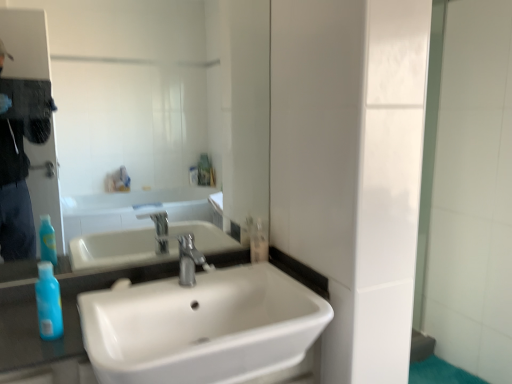
Identify the location of matte glass mirror at upper center. (162, 94).

The height and width of the screenshot is (384, 512). Describe the element at coordinates (258, 243) in the screenshot. I see `clear plastic bottle at center, positioned as the second mouthwash in front-to-back order` at that location.

What do you see at coordinates (204, 328) in the screenshot?
I see `white glossy sink at center` at bounding box center [204, 328].

Describe the element at coordinates (189, 260) in the screenshot. I see `silver metallic faucet at center` at that location.

In order to click on blue translucent bottle at lower left, the 2th mouthwash positioned from the right in this screenshot , I will do `click(48, 303)`.

Identify the location of mouthwash that appears below the clear plastic bottle at center, acting as the second mouthwash starting from the left (from the image's perspective). (48, 303).

Is clear plastic bottle at center, which is the 1th mouthwash from back to front, located outside blue translucent bottle at lower left, the 1th mouthwash when ordered from left to right?

Yes, clear plastic bottle at center, which is the 1th mouthwash from back to front, is not within blue translucent bottle at lower left, the 1th mouthwash when ordered from left to right.

Between clear plastic bottle at center, acting as the second mouthwash starting from the left, and blue translucent bottle at lower left, the 2th mouthwash positioned from the right, which one is positioned behind?

clear plastic bottle at center, acting as the second mouthwash starting from the left, is further from the camera.

From a real-world perspective, between clear plastic bottle at center, acting as the second mouthwash starting from the left, and blue translucent bottle at lower left, the 2th mouthwash positioned from the right, who is vertically lower?

blue translucent bottle at lower left, the 2th mouthwash positioned from the right, is physically lower.

From the image's perspective, is silver metallic faucet at center located above blue translucent bottle at lower left, the 2th mouthwash from the back?

Indeed, from the image's perspective, silver metallic faucet at center is shown above blue translucent bottle at lower left, the 2th mouthwash from the back.

Between silver metallic faucet at center and blue translucent bottle at lower left, the 2th mouthwash positioned from the right, which one appears on the right side from the viewer's perspective?

silver metallic faucet at center is more to the right.

Which of these two, silver metallic faucet at center or blue translucent bottle at lower left, the 2th mouthwash positioned from the right, is thinner?

Thinner between the two is blue translucent bottle at lower left, the 2th mouthwash positioned from the right.

From a real-world perspective, is silver metallic faucet at center located beneath blue translucent bottle at lower left, the 2th mouthwash positioned from the right?

No, from a real-world perspective, silver metallic faucet at center is not beneath blue translucent bottle at lower left, the 2th mouthwash positioned from the right.

Is blue translucent bottle at lower left, the 1th mouthwash when ordered from left to right, wider than clear plastic bottle at center, which is the 1th mouthwash from back to front?

Incorrect, the width of blue translucent bottle at lower left, the 1th mouthwash when ordered from left to right, does not surpass that of clear plastic bottle at center, which is the 1th mouthwash from back to front.

Do you think blue translucent bottle at lower left, the 1th mouthwash when ordered from left to right, is within clear plastic bottle at center, which is the 1th mouthwash from back to front, or outside of it?

blue translucent bottle at lower left, the 1th mouthwash when ordered from left to right, cannot be found inside clear plastic bottle at center, which is the 1th mouthwash from back to front.

Identify the location of mouthwash on the right of blue translucent bottle at lower left, the 2th mouthwash from the back. The width and height of the screenshot is (512, 384). pyautogui.click(x=258, y=243).

Which object is positioned more to the right, blue translucent bottle at lower left, the 1th mouthwash when ordered from left to right, or clear plastic bottle at center, placed as the first mouthwash when sorted from right to left?

clear plastic bottle at center, placed as the first mouthwash when sorted from right to left.

Is clear plastic bottle at center, placed as the first mouthwash when sorted from right to left, surrounded by silver metallic faucet at center?

No, clear plastic bottle at center, placed as the first mouthwash when sorted from right to left, is not surrounded by silver metallic faucet at center.

From a real-world perspective, between silver metallic faucet at center and clear plastic bottle at center, placed as the first mouthwash when sorted from right to left, who is vertically lower?

clear plastic bottle at center, placed as the first mouthwash when sorted from right to left.

From their relative heights in the image, would you say silver metallic faucet at center is taller or shorter than clear plastic bottle at center, which is the 1th mouthwash from back to front?

In the image, silver metallic faucet at center appears to be taller than clear plastic bottle at center, which is the 1th mouthwash from back to front.

From the image's perspective, between silver metallic faucet at center and clear plastic bottle at center, placed as the first mouthwash when sorted from right to left, who is located below?

silver metallic faucet at center appears lower in the image.

Which of these two, blue translucent bottle at lower left, the 2th mouthwash from the back, or white glossy sink at center, is thinner?

blue translucent bottle at lower left, the 2th mouthwash from the back, is thinner.

Is white glossy sink at center located within blue translucent bottle at lower left, the 1th mouthwash when ordered from left to right?

Definitely not — white glossy sink at center is not inside blue translucent bottle at lower left, the 1th mouthwash when ordered from left to right.

Which is more to the right, blue translucent bottle at lower left, the 2th mouthwash positioned from the right, or white glossy sink at center?

white glossy sink at center is more to the right.

Which of these two, blue translucent bottle at lower left, the 2th mouthwash from the back, or white glossy sink at center, is bigger?

Bigger between the two is white glossy sink at center.

Choose the correct answer: Is blue translucent bottle at lower left, arranged as the first mouthwash when viewed from the front, inside silver metallic faucet at center or outside it?

blue translucent bottle at lower left, arranged as the first mouthwash when viewed from the front, is located beyond the bounds of silver metallic faucet at center.

Which object is closer to the camera, blue translucent bottle at lower left, the 2th mouthwash from the back, or silver metallic faucet at center?

blue translucent bottle at lower left, the 2th mouthwash from the back.

From the image's perspective, which object appears higher, blue translucent bottle at lower left, the 2th mouthwash from the back, or silver metallic faucet at center?

silver metallic faucet at center appears higher in the image.

Considering the sizes of objects clear plastic bottle at center, positioned as the second mouthwash in front-to-back order, and matte glass mirror at upper center in the image provided, who is bigger, clear plastic bottle at center, positioned as the second mouthwash in front-to-back order, or matte glass mirror at upper center?

With larger size is matte glass mirror at upper center.

Can you tell me how much clear plastic bottle at center, which is the 1th mouthwash from back to front, and matte glass mirror at upper center differ in facing direction?

They differ by 0.676 degrees in their facing directions.

Visually, is clear plastic bottle at center, placed as the first mouthwash when sorted from right to left, positioned to the left or to the right of matte glass mirror at upper center?

Clearly, clear plastic bottle at center, placed as the first mouthwash when sorted from right to left, is on the right of matte glass mirror at upper center in the image.

Find the location of a particular element. mouthwash that appears above the blue translucent bottle at lower left, the 2th mouthwash from the back (from the image's perspective) is located at coordinates (258, 243).

Locate an element on the screen. Image resolution: width=512 pixels, height=384 pixels. mouthwash in front of the silver metallic faucet at center is located at coordinates (48, 303).

Looking at the image, which one is located closer to clear plastic bottle at center, which is the 1th mouthwash from back to front, silver metallic faucet at center or blue translucent bottle at lower left, the 1th mouthwash when ordered from left to right?

Based on the image, silver metallic faucet at center appears to be nearer to clear plastic bottle at center, which is the 1th mouthwash from back to front.

Looking at the image, which one is located further to matte glass mirror at upper center, clear plastic bottle at center, acting as the second mouthwash starting from the left, or blue translucent bottle at lower left, arranged as the first mouthwash when viewed from the front?

blue translucent bottle at lower left, arranged as the first mouthwash when viewed from the front, lies further to matte glass mirror at upper center than the other object.

Which object lies further to the anchor point blue translucent bottle at lower left, the 2th mouthwash positioned from the right, clear plastic bottle at center, placed as the first mouthwash when sorted from right to left, or matte glass mirror at upper center?

Based on the image, matte glass mirror at upper center appears to be further to blue translucent bottle at lower left, the 2th mouthwash positioned from the right.

When comparing their distances from silver metallic faucet at center, does white glossy sink at center or blue translucent bottle at lower left, the 2th mouthwash from the back, seem further?

blue translucent bottle at lower left, the 2th mouthwash from the back, is positioned further to the anchor silver metallic faucet at center.

Looking at the image, which one is located closer to blue translucent bottle at lower left, the 1th mouthwash when ordered from left to right, silver metallic faucet at center or matte glass mirror at upper center?

silver metallic faucet at center lies closer to blue translucent bottle at lower left, the 1th mouthwash when ordered from left to right, than the other object.

Based on their spatial positions, is white glossy sink at center or clear plastic bottle at center, which is the 1th mouthwash from back to front, closer to matte glass mirror at upper center?

Among the two, white glossy sink at center is located nearer to matte glass mirror at upper center.

Which object lies further to the anchor point matte glass mirror at upper center, silver metallic faucet at center or white glossy sink at center?

silver metallic faucet at center is further to matte glass mirror at upper center.

When comparing their distances from silver metallic faucet at center, does blue translucent bottle at lower left, the 2th mouthwash from the back, or white glossy sink at center seem further?

blue translucent bottle at lower left, the 2th mouthwash from the back, is further to silver metallic faucet at center.

Locate an element on the screen. This screenshot has width=512, height=384. mirror situated between blue translucent bottle at lower left, the 2th mouthwash positioned from the right, and clear plastic bottle at center, which is the 1th mouthwash from back to front, from left to right is located at coordinates (162, 94).

Locate an element on the screen. tap situated between blue translucent bottle at lower left, the 2th mouthwash from the back, and white glossy sink at center from left to right is located at coordinates (189, 260).

Identify the location of mouthwash between white glossy sink at center and clear plastic bottle at center, acting as the second mouthwash starting from the left, along the z-axis. This screenshot has height=384, width=512. (48, 303).

Locate an element on the screen. The width and height of the screenshot is (512, 384). tap between white glossy sink at center and clear plastic bottle at center, placed as the first mouthwash when sorted from right to left, along the z-axis is located at coordinates (189, 260).